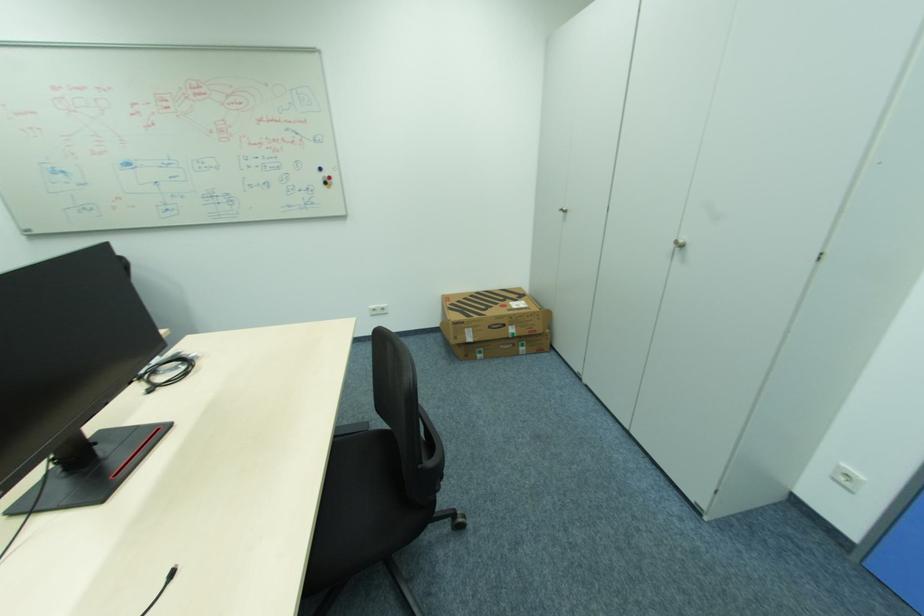
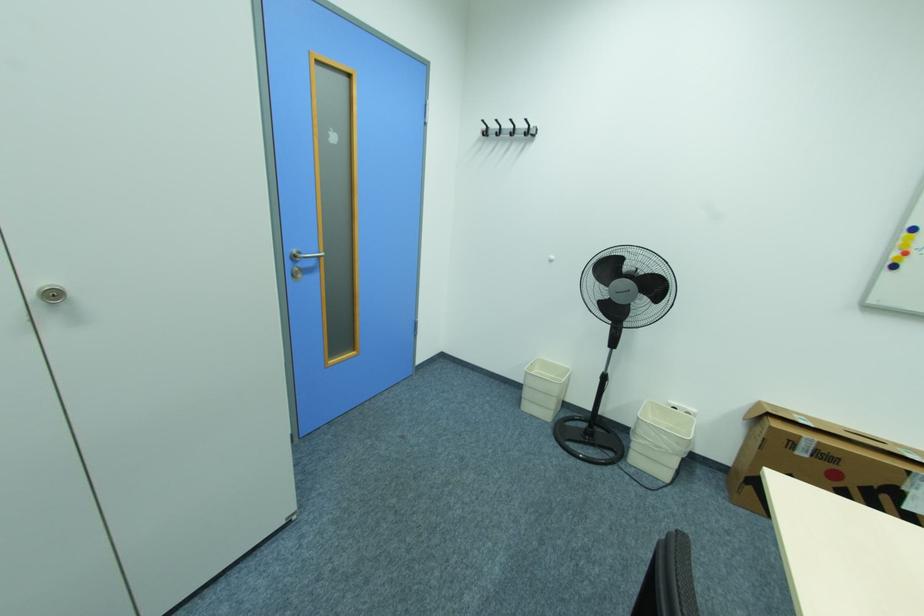
Locate, in the second image, the point that corresponds to point (687, 246) in the first image.

(64, 294)